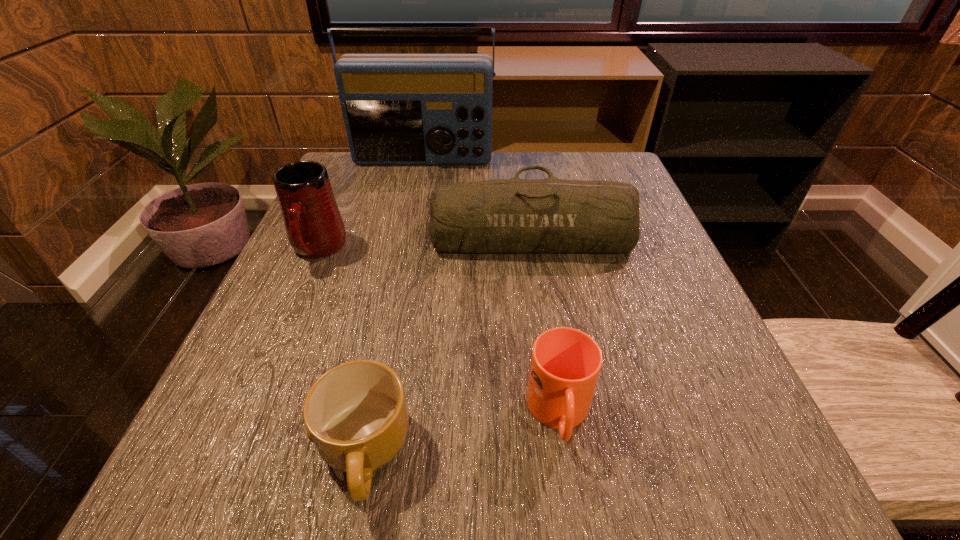
Locate an element on the screen. The height and width of the screenshot is (540, 960). vacant space located 0.090m on the side of the tallest mug with the handle is located at coordinates (291, 309).

You are a GUI agent. You are given a task and a screenshot of the screen. Output one action in this format:
    pyautogui.click(x=<x>, y=<y>)
    Task: Click on the vacant space located 0.260m on the front of the duffel bag
    
    Given the screenshot: What is the action you would take?
    pyautogui.click(x=550, y=376)

Identify the location of vacant space located 0.060m on the handle side of the rightmost mug. The height and width of the screenshot is (540, 960). (574, 510).

Locate an element on the screen. Image resolution: width=960 pixels, height=540 pixels. object positioned at the far edge is located at coordinates (399, 109).

The height and width of the screenshot is (540, 960). I want to click on radio receiver located at the left edge, so (x=399, y=109).

This screenshot has height=540, width=960. I want to click on object situated at the right edge, so point(502,216).

You are a GUI agent. You are given a task and a screenshot of the screen. Output one action in this format:
    pyautogui.click(x=<x>, y=<y>)
    Task: Click on the object present at the far left corner
    Image resolution: width=960 pixels, height=540 pixels.
    Given the screenshot: What is the action you would take?
    [x=399, y=109]

Identify the location of object at the near left corner. (356, 414).

In the image, there is a desktop. At what (x,y) coordinates should I click in order to perform the action: click on vacant space at the far edge. Please return your answer as a coordinate pair (x, y). Looking at the image, I should click on [492, 167].

Identify the location of vacant region at the near edge of the desktop. (654, 501).